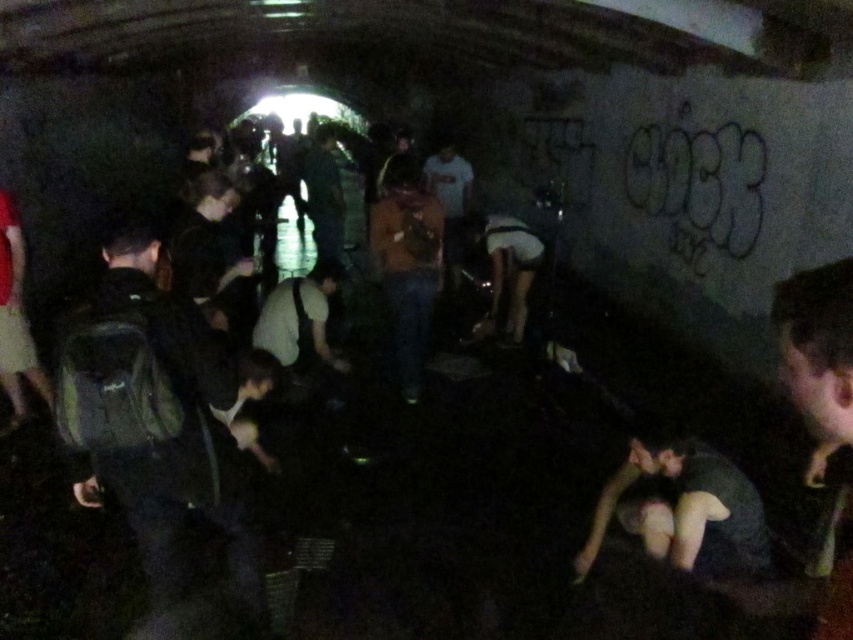
You are a person in the tunnel and want to know if your orange fabric shirt at center is wider than your white matte shorts at center. Can you determine this based on the scene?

The orange fabric shirt at center is thinner than white matte shorts at center, so the shirt is not wider than the shorts.

You are a photographer trying to capture a candid shot of the people in the tunnel. You notice the white matte shorts at center and the dark green shirt at center. Which clothing item appears wider in the photo?

The white matte shorts at center appears wider than the dark green shirt at center in the photo since its width surpasses the shirt.